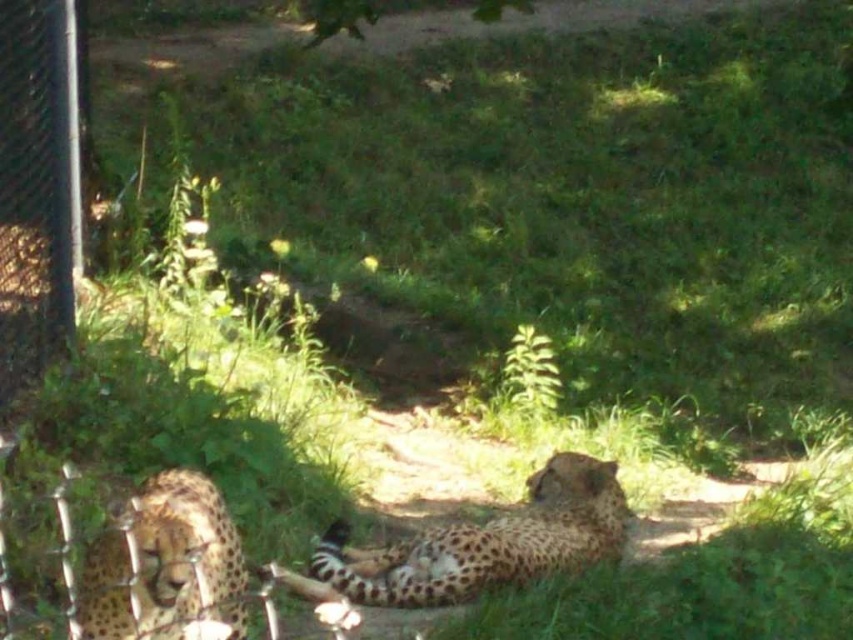
Who is higher up, spotted fur cheetah at center or spotted fur cheetah at lower left?

spotted fur cheetah at lower left is higher up.

How distant is spotted fur cheetah at center from spotted fur cheetah at lower left?

They are 1.45 meters apart.

Is point (560, 557) closer to camera compared to point (229, 525)?

No, it is not.

I want to click on spotted fur cheetah at center, so click(486, 541).